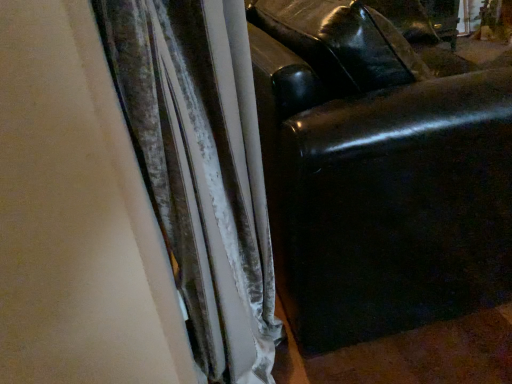
Question: Does black leather couch at right come behind velvet curtain at center?

Choices:
 (A) yes
 (B) no

Answer: (A)

Question: From the image's perspective, is black leather couch at right above velvet curtain at center?

Choices:
 (A) no
 (B) yes

Answer: (B)

Question: Does black leather couch at right have a greater height compared to velvet curtain at center?

Choices:
 (A) no
 (B) yes

Answer: (A)

Question: Is black leather couch at right not near velvet curtain at center?

Choices:
 (A) yes
 (B) no

Answer: (B)

Question: Can you confirm if black leather couch at right is wider than velvet curtain at center?

Choices:
 (A) no
 (B) yes

Answer: (B)

Question: Is black leather couch at right thinner than velvet curtain at center?

Choices:
 (A) yes
 (B) no

Answer: (B)

Question: From a real-world perspective, is velvet curtain at center beneath black leather couch at right?

Choices:
 (A) yes
 (B) no

Answer: (B)

Question: Is velvet curtain at center far from black leather couch at right?

Choices:
 (A) yes
 (B) no

Answer: (B)

Question: Is the surface of velvet curtain at center in direct contact with black leather couch at right?

Choices:
 (A) yes
 (B) no

Answer: (B)

Question: Can you confirm if velvet curtain at center is bigger than black leather couch at right?

Choices:
 (A) no
 (B) yes

Answer: (A)

Question: Could you tell me if velvet curtain at center is facing black leather couch at right?

Choices:
 (A) no
 (B) yes

Answer: (B)

Question: Does velvet curtain at center appear on the right side of black leather couch at right?

Choices:
 (A) yes
 (B) no

Answer: (B)

Question: Is velvet curtain at center inside or outside of black leather couch at right?

Choices:
 (A) outside
 (B) inside

Answer: (A)